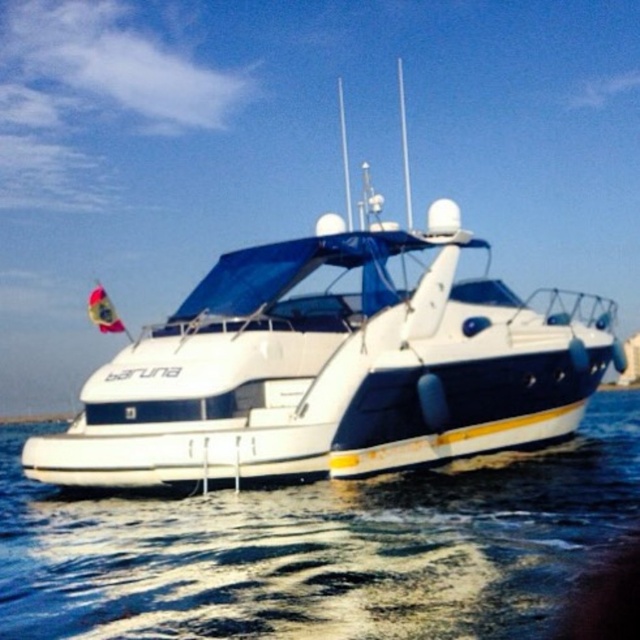
You are a photographer planning to capture the white glossy boat at center and the white smooth water at lower center in a single shot. Given that your camera can only focus on one object at a time, which object should you prioritize focusing on to ensure it appears larger in the photo?

The white glossy boat at center is bigger than the white smooth water at lower center, so you should prioritize focusing on the white glossy boat at center to ensure it appears larger in the photo.

From the picture: You are standing on the dock next to the white glossy boat at center and the white smooth water at lower center. Which object is taller from your perspective?

The white glossy boat at center is much taller than the white smooth water at lower center.

You are standing on the deck of the yacht Baruna and want to determine the relative positions of two points marked on the deck. Which of the two points, point (454, 349) or point (573, 451), is closer to you?

Point (454, 349) is closer to the viewer than point (573, 451).